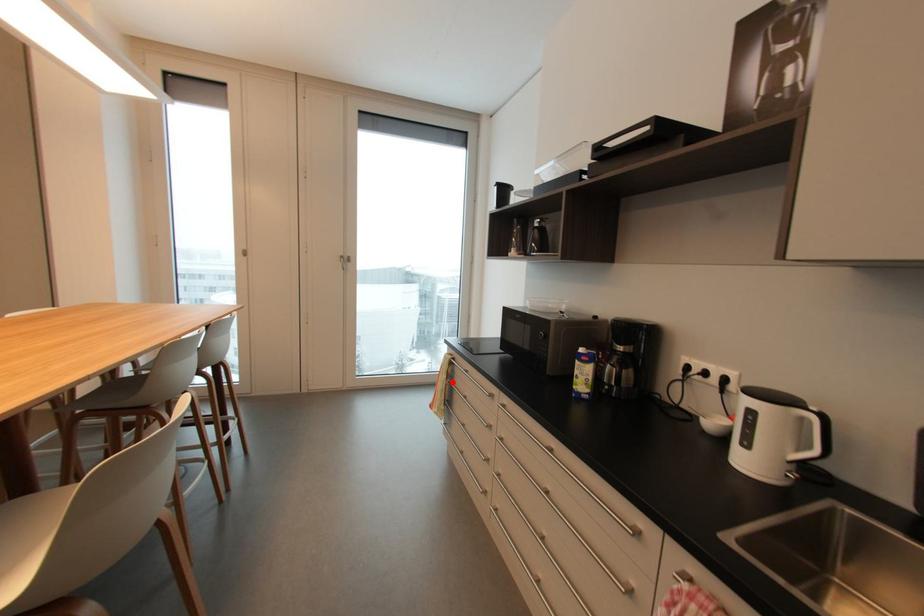
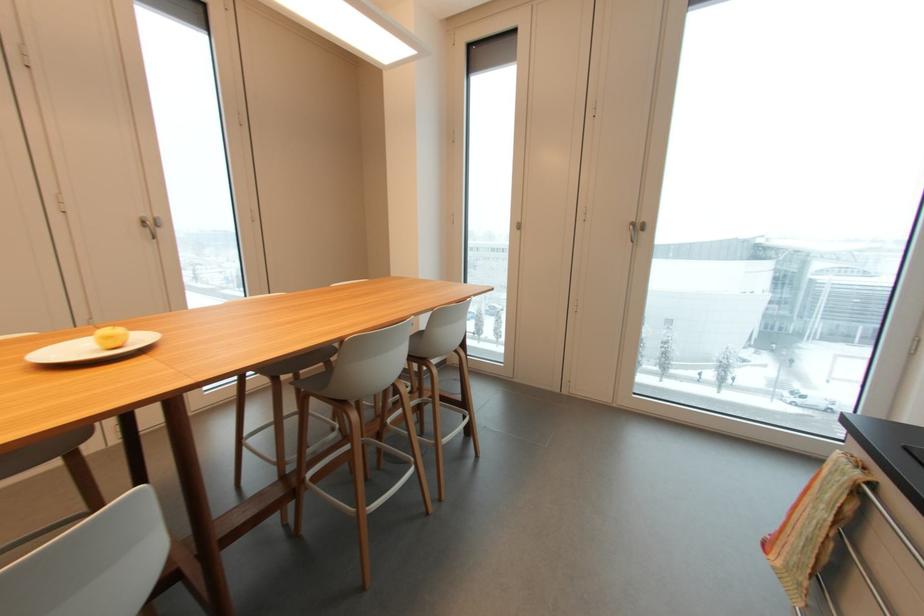
In the second image, find the point that corresponds to the highlighted location in the first image.

(843, 533)